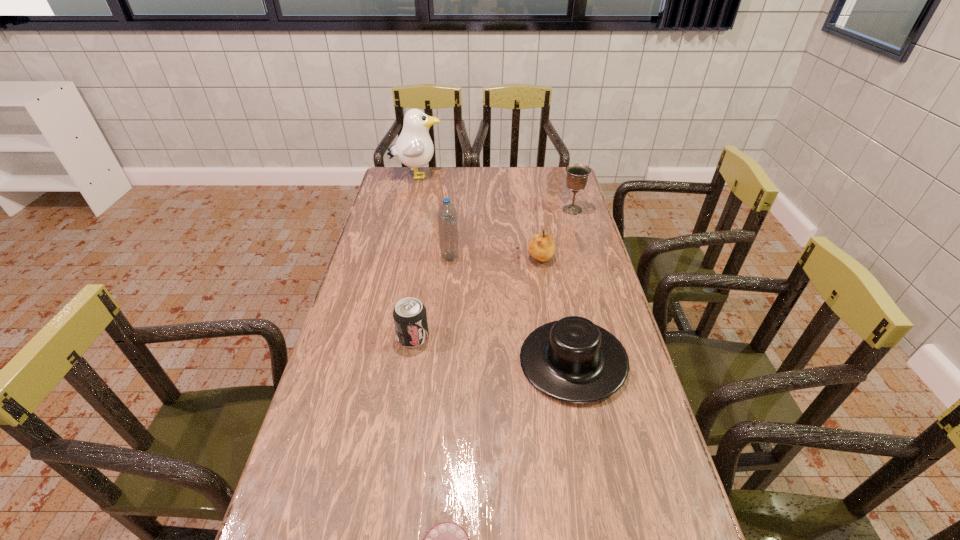
Find the location of a particular element. The width and height of the screenshot is (960, 540). vacant space situated on the back of the chalice is located at coordinates (561, 170).

The image size is (960, 540). What are the coordinates of `free region located 0.390m on the left of the pear` in the screenshot? It's located at (403, 259).

You are a GUI agent. You are given a task and a screenshot of the screen. Output one action in this format:
    pyautogui.click(x=<x>, y=<y>)
    Task: Click on the vacant space located 0.290m on the right of the soda can
    The width and height of the screenshot is (960, 540).
    Given the screenshot: What is the action you would take?
    pyautogui.click(x=531, y=337)

Image resolution: width=960 pixels, height=540 pixels. What are the coordinates of `vacant region located on the left of the dress hat` in the screenshot? It's located at (395, 360).

Locate an element on the screen. object located in the far edge section of the desktop is located at coordinates (414, 148).

Image resolution: width=960 pixels, height=540 pixels. What are the coordinates of `object that is at the left edge` in the screenshot? It's located at (414, 148).

Where is `chalice positioned at the right edge`? chalice positioned at the right edge is located at coordinates (577, 174).

Where is `pear at the right edge`? Image resolution: width=960 pixels, height=540 pixels. pear at the right edge is located at coordinates (541, 247).

I want to click on dress hat that is at the right edge, so click(x=573, y=360).

At what (x,y) coordinates should I click in order to perform the action: click on object located at the far left corner. Please return your answer as a coordinate pair (x, y). Looking at the image, I should click on (414, 148).